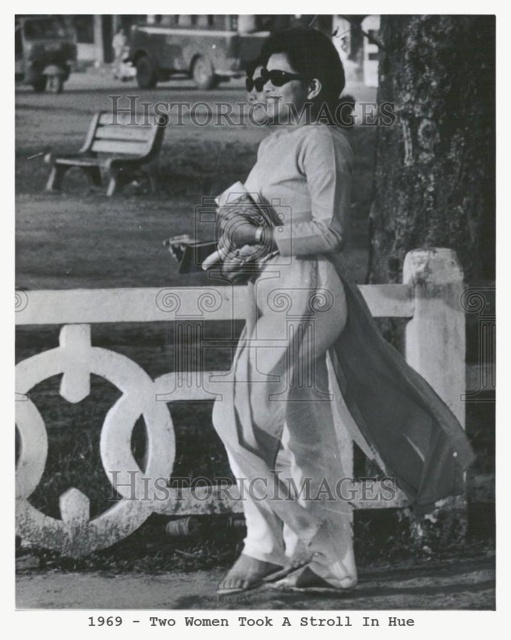
Question: Considering the relative positions of silky white ao dai at center and wooden park bench at left in the image provided, where is silky white ao dai at center located with respect to wooden park bench at left?

Choices:
 (A) left
 (B) right

Answer: (B)

Question: Which point is farther from the camera taking this photo?

Choices:
 (A) (339, 464)
 (B) (270, 81)
 (C) (80, 148)

Answer: (C)

Question: Does silky white ao dai at center appear on the right side of black plastic goggles at upper center?

Choices:
 (A) no
 (B) yes

Answer: (B)

Question: Estimate the real-world distances between objects in this image. Which object is farther from the wooden park bench at left?

Choices:
 (A) black plastic goggles at upper center
 (B) silky white ao dai at center

Answer: (B)

Question: Which of the following is the closest to the observer?

Choices:
 (A) black plastic goggles at upper center
 (B) wooden park bench at left

Answer: (A)

Question: Is wooden park bench at left positioned behind black plastic goggles at upper center?

Choices:
 (A) yes
 (B) no

Answer: (A)